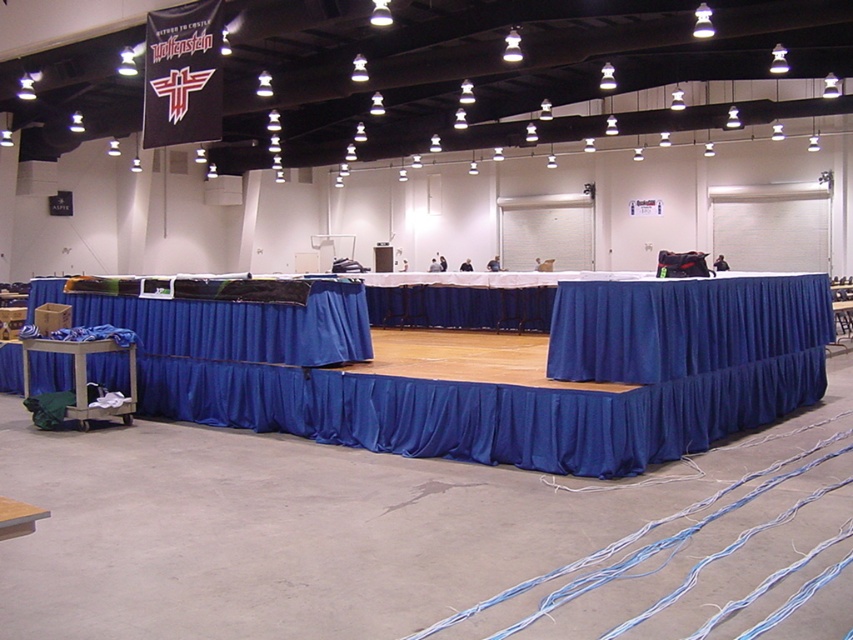
You are setting up for an event and need to access the green fabric cart at lower left. Can you reach it easily since it is partially covered by the blue fabric tablecloth at left?

The blue fabric tablecloth at left is positioned over green fabric cart at lower left, so the cart is partially obscured and accessing it might be challenging. You may need to move the tablecloth first.

You are standing in the event space and see the point marked at coordinates (231, 324). According to the image, what is this point located on?

The point at (231, 324) is located on the blue fabric tablecloth at left.